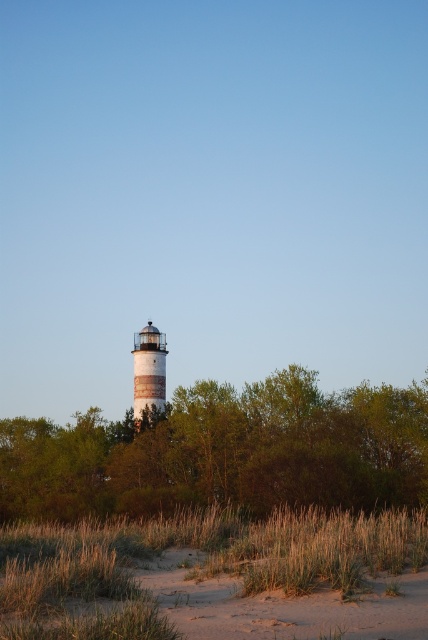
Is point (362, 456) closer to camera compared to point (214, 556)?

No, (362, 456) is behind (214, 556).

Does green leafy tree at center have a lesser width compared to brown sandy beach at lower center?

No, green leafy tree at center is not thinner than brown sandy beach at lower center.

Does point (86, 500) lie in front of point (110, 602)?

No, (86, 500) is behind (110, 602).

I want to click on green leafy tree at center, so click(x=223, y=452).

Which is more to the left, brown sandy beach at lower center or white painted wood lighthouse at center?

From the viewer's perspective, white painted wood lighthouse at center appears more on the left side.

Does point (211, 508) come in front of point (142, 356)?

Yes, it is in front of point (142, 356).

Between point (372, 518) and point (133, 353), which one is positioned in front?

Point (372, 518) is more forward.

You are a GUI agent. You are given a task and a screenshot of the screen. Output one action in this format:
    pyautogui.click(x=<x>, y=<y>)
    Task: Click on the brown sandy beach at lower center
    
    Given the screenshot: What is the action you would take?
    pyautogui.click(x=189, y=564)

Can you confirm if green leafy tree at center is positioned below white painted wood lighthouse at center?

Indeed, green leafy tree at center is positioned under white painted wood lighthouse at center.

Who is positioned more to the right, green leafy tree at center or white painted wood lighthouse at center?

green leafy tree at center is more to the right.

Which is in front, point (409, 413) or point (151, 401)?

Positioned in front is point (409, 413).

This screenshot has width=428, height=640. I want to click on green leafy tree at center, so click(x=223, y=452).